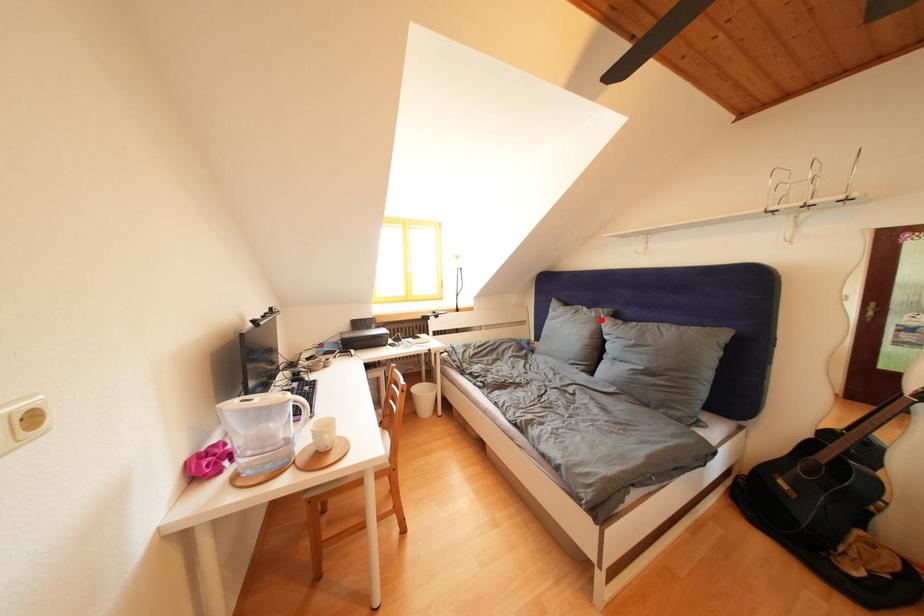
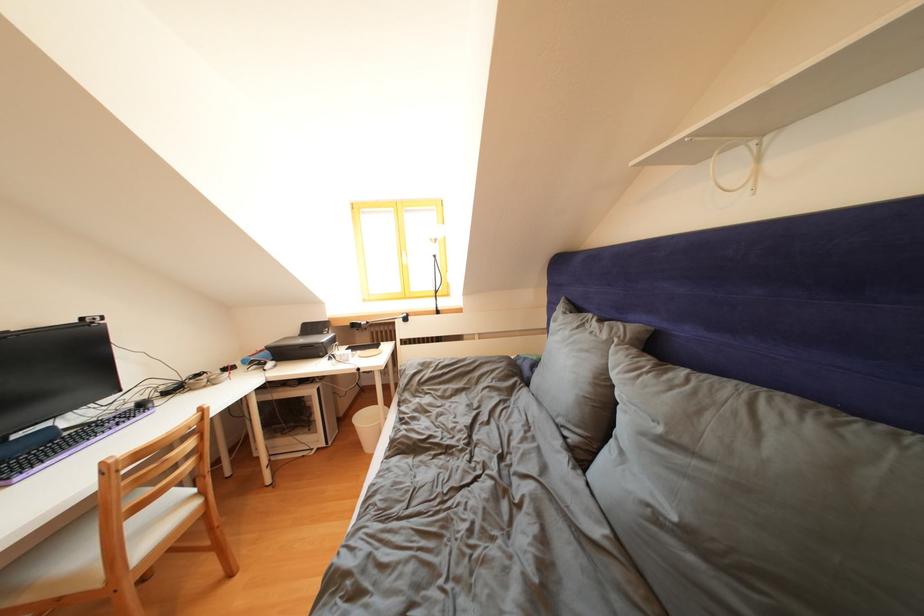
In the second image, find the point that corresponds to the highlighted location in the first image.

(612, 341)